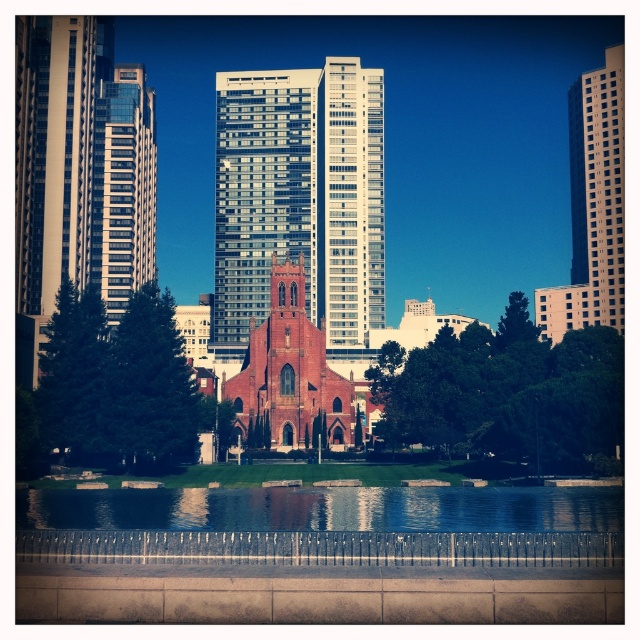
Question: Does white glass skyscraper at center lie in front of green leafy tree at center?

Choices:
 (A) no
 (B) yes

Answer: (A)

Question: Is green leafy tree at center above red brick church at center?

Choices:
 (A) no
 (B) yes

Answer: (B)

Question: Estimate the real-world distances between objects in this image. Which object is closer to the beige glass skyscraper at right?

Choices:
 (A) green matte tree at left
 (B) clear water at lower center
 (C) red brick church at center
 (D) white glass skyscraper at center

Answer: (D)

Question: Which of the following is the farthest from the observer?

Choices:
 (A) (262, 196)
 (B) (276, 269)
 (C) (612, 218)

Answer: (A)

Question: Considering the real-world distances, which object is farthest from the green leafy tree at center?

Choices:
 (A) red brick church at center
 (B) glassy reflective skyscraper at left
 (C) clear water at lower center
 (D) white glass skyscraper at center

Answer: (B)

Question: Can you confirm if green matte tree at left is positioned to the left of beige glass skyscraper at right?

Choices:
 (A) no
 (B) yes

Answer: (B)